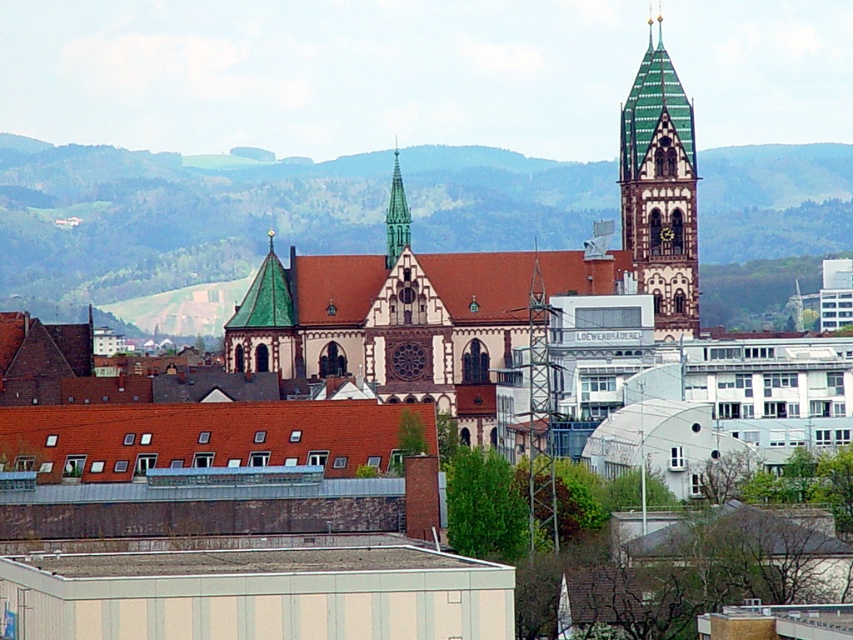
You are a city planner assessing the skyline of this area. You need to determine which of the two landmarks, the green mosaic tower at upper center or the dark brown wooden clock at center, is taller. Based on the image, which one is taller?

The green mosaic tower at upper center is taller than the dark brown wooden clock at center according to the description.

You are an architect designing a new building that needs to fit between the green glass spire at center and the dark brown wooden clock at center. Given that the space between them is only 2 meters wide, will the new building of 1.8 meters in width fit without overlapping either structure?

The green glass spire at center has a larger width than the dark brown wooden clock at center. However, the total space between them is 2 meters. Since the new building is 1.8 meters wide, it can fit within the 2 meters space as long as there is enough clearance on both sides. The width of the structures themselves does not directly affect the available space between them, so the building should fit.